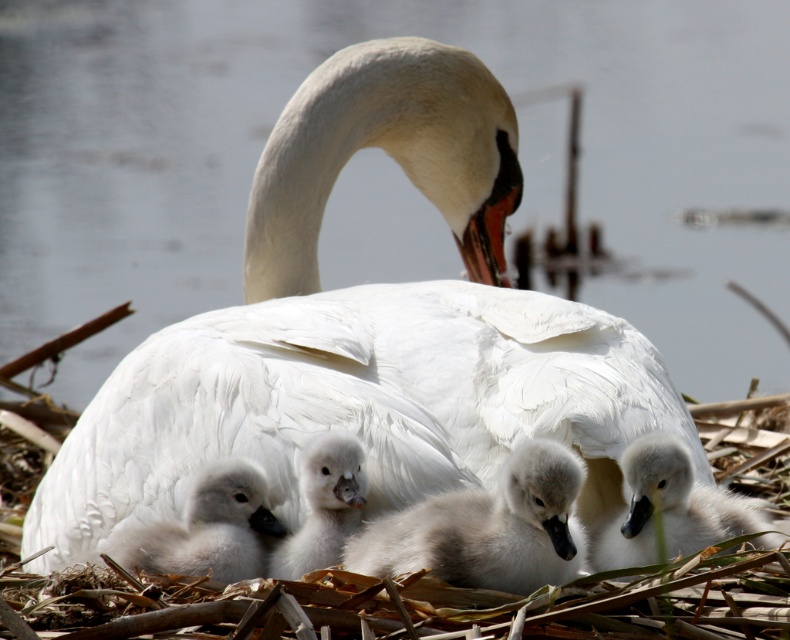
You are a wildlife photographer observing the swan and its cygnets. You want to capture a photo where the soft gray downy cygnet at center is visible above the fluffy white cygnet at lower left. Is this possible based on their current positions?

Yes, because the soft gray downy cygnet at center is located above the fluffy white cygnet at lower left according to their positions.

You are a wildlife photographer observing the swan and its cygnets. You want to capture a photo where the soft gray downy cygnet at center is clearly visible between the white fluffy swan at center and the reed nest. Based on their sizes, will the cygnet be fully visible without being blocked by the swan?

The soft gray downy cygnet at center is taller than the white fluffy swan at center, so the cygnet will be fully visible and not blocked by the swan.